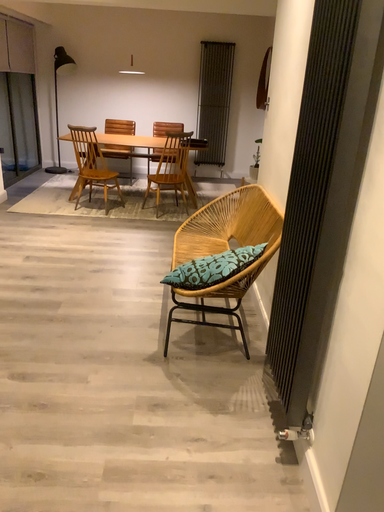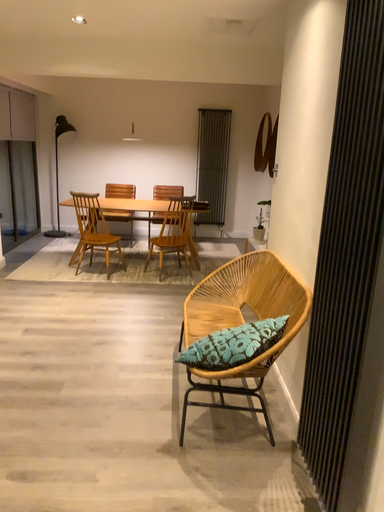
Question: How did the camera likely rotate when shooting the video?

Choices:
 (A) rotated downward
 (B) rotated upward

Answer: (B)